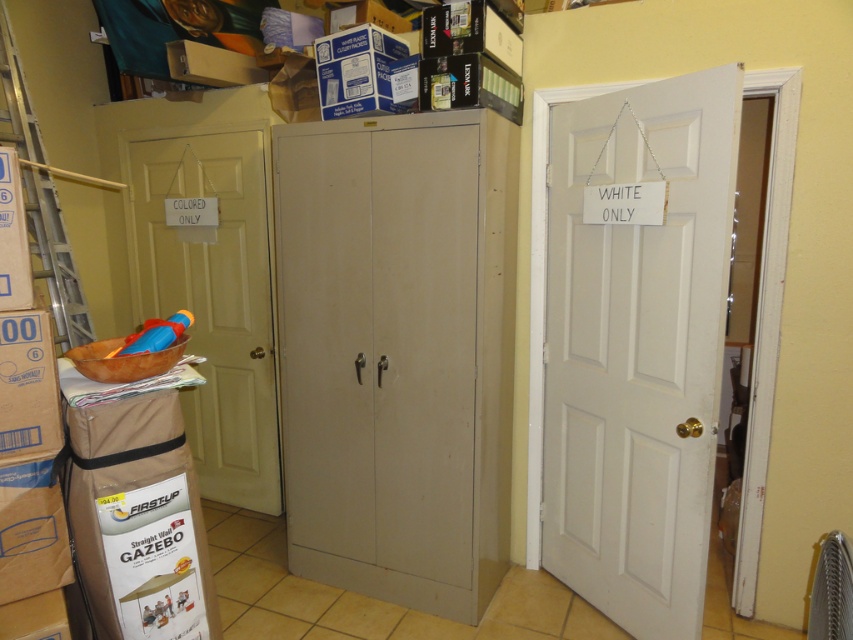
Question: Is matte white door at left smaller than silver metallic ladder at left?

Choices:
 (A) yes
 (B) no

Answer: (B)

Question: Which object is farther from the camera taking this photo?

Choices:
 (A) brown cardboard box at left
 (B) silver metallic ladder at left

Answer: (B)

Question: Considering the relative positions of white matte door at right and brown cardboard box at left in the image provided, where is white matte door at right located with respect to brown cardboard box at left?

Choices:
 (A) left
 (B) right

Answer: (B)

Question: Estimate the real-world distances between objects in this image. Which object is farther from the matte white door at left?

Choices:
 (A) silver metallic ladder at left
 (B) brown cardboard box at left

Answer: (B)

Question: Is white matte door at right wider than silver metallic ladder at left?

Choices:
 (A) no
 (B) yes

Answer: (B)

Question: Which point appears closest to the camera in this image?

Choices:
 (A) (20, 221)
 (B) (564, 291)

Answer: (A)